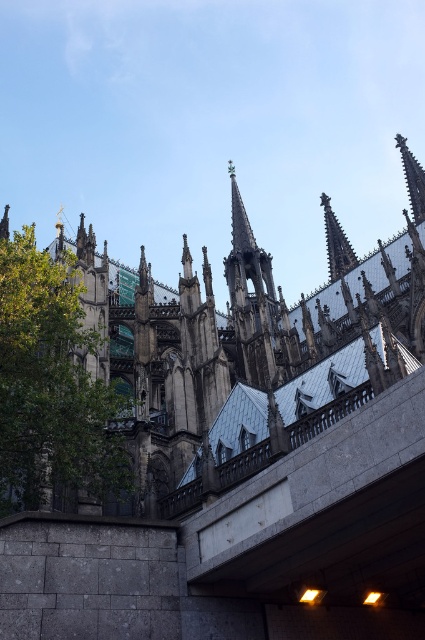
You are a visitor standing in front of the cathedral. You notice a green leafy tree at left and a dark gray stone spire at center. Which object takes up more visual space in the image?

The dark gray stone spire at center occupies more visual space than the green leafy tree at left according to the description.

Based on the scene of the Gothic cathedral with a green leafy tree at left and a dark gray stone spire at center, which object is taller?

The dark gray stone spire at center is taller than the green leafy tree at left.

You are standing in front of the cathedral and want to take a photo of the dark gray stone spire at center without any obstructions. Is the green leafy tree at left blocking your view of the spire?

The green leafy tree at left is in front of the dark gray stone spire at center, so it is blocking your view of the spire.